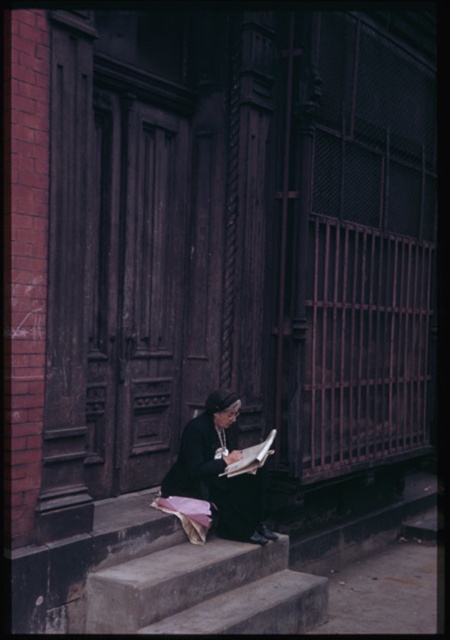
You are a delivery person trying to place a large package on the concrete stairs at lower center. The package is as wide as the black matte robe at lower center. Will the package fit on the stairs without overhanging?

The concrete stairs at lower center are wider than the black matte robe at lower center, so the package, being as wide as the robe, will fit on the stairs without overhanging.

You are a delivery person trying to place a package on the concrete stairs at lower center while ensuring the black matte robe at lower center is not obstructed. Can the package be placed without covering the robe?

The concrete stairs at lower center is larger in size than black matte robe at lower center, so yes, the package can be placed on the stairs without covering the robe since there is enough space.

You are a delivery person who needs to place a small package between the concrete stairs at lower center and the black matte robe at lower center. Can you fit the package there if it measures 50 centimeters in length?

The distance between the concrete stairs at lower center and the black matte robe at lower center is 47.71 centimeters. Since the package is 50 centimeters long, it will not fit in the available space.